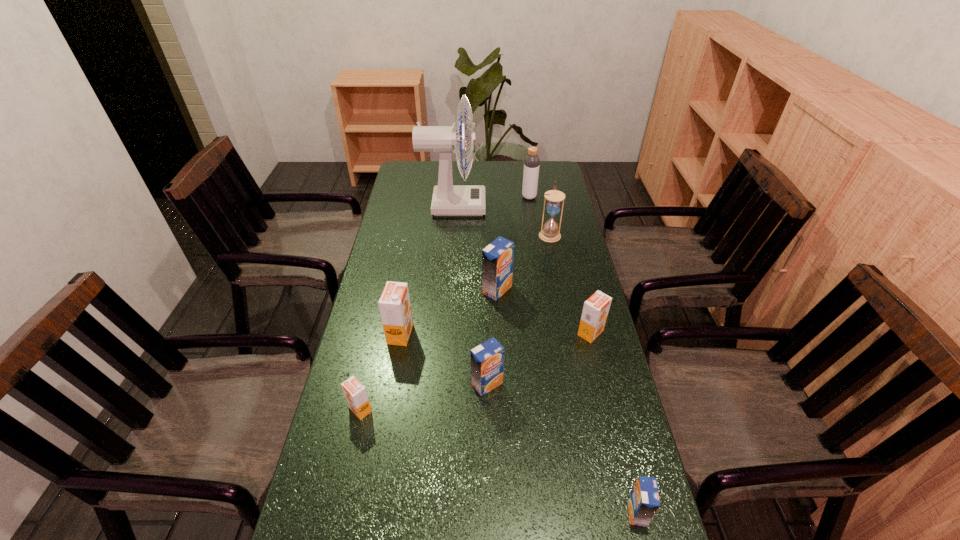
Find the location of a particular element. free spot at the left edge of the desktop is located at coordinates (373, 402).

Find the location of a particular element. Image resolution: width=960 pixels, height=540 pixels. free space at the right edge is located at coordinates (607, 385).

This screenshot has height=540, width=960. I want to click on vacant space at the far right corner of the desktop, so click(540, 180).

Locate an element on the screen. The height and width of the screenshot is (540, 960). unoccupied area between the second orange juice from left to right and the blue fan is located at coordinates [x=427, y=270].

You are a GUI agent. You are given a task and a screenshot of the screen. Output one action in this format:
    pyautogui.click(x=<x>, y=<y>)
    Task: Click on the free spot between the nearest blue orange_juice and the white hourglass
    This screenshot has height=540, width=960.
    Given the screenshot: What is the action you would take?
    click(x=593, y=373)

The width and height of the screenshot is (960, 540). Identify the location of vacant point located between the biggest blue orange_juice and the tallest object. (475, 248).

Image resolution: width=960 pixels, height=540 pixels. What are the coordinates of `vacant area that lies between the white hourglass and the fifth farthest orange juice` in the screenshot? It's located at (455, 322).

Locate an element on the screen. The image size is (960, 540). unoccupied area between the farthest orange juice and the tallest object is located at coordinates (475, 248).

This screenshot has width=960, height=540. Identify the location of vacant area that lies between the second orange juice from left to right and the white hourglass. (475, 284).

This screenshot has height=540, width=960. Identify the location of blank region between the second orange orange juice from right to left and the tallest object. (427, 270).